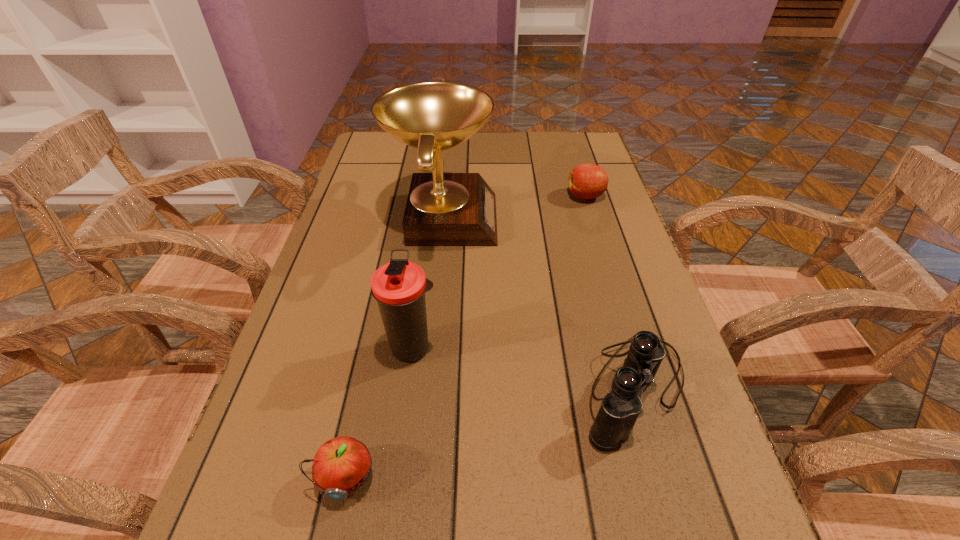
Locate an element on the screen. This screenshot has width=960, height=540. award present at the left edge is located at coordinates [443, 209].

Find the location of a particular element. The image size is (960, 540). apple present at the left edge is located at coordinates (341, 466).

Locate an element on the screen. binoculars located at the right edge is located at coordinates (620, 408).

Where is `apple positioned at the right edge`? apple positioned at the right edge is located at coordinates (586, 181).

In the image, there is a desktop. Identify the location of free region at the far edge. (417, 166).

You are a GUI agent. You are given a task and a screenshot of the screen. Output one action in this format:
    pyautogui.click(x=<x>, y=<y>)
    Task: Click on the vacant space at the left edge of the desktop
    The width and height of the screenshot is (960, 540).
    Given the screenshot: What is the action you would take?
    pyautogui.click(x=397, y=206)

Where is `free space at the right edge of the desktop`? This screenshot has width=960, height=540. free space at the right edge of the desktop is located at coordinates (625, 308).

The image size is (960, 540). Identify the location of blank area at the far left corner. (362, 152).

At what (x,y) coordinates should I click in order to perform the action: click on vacant point located between the award and the right apple. Please return your answer as a coordinate pair (x, y). The image size is (960, 540). Looking at the image, I should click on (515, 207).

You are a GUI agent. You are given a task and a screenshot of the screen. Output one action in this format:
    pyautogui.click(x=<x>, y=<y>)
    Task: Click on the free space between the nearer apple and the farther apple
    Image resolution: width=960 pixels, height=540 pixels.
    Given the screenshot: What is the action you would take?
    pyautogui.click(x=466, y=337)